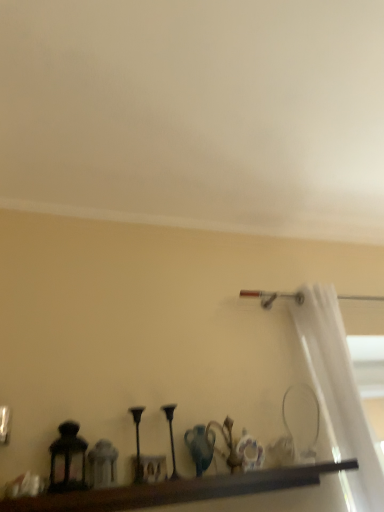
Question: Considering the relative sizes of matte black lantern at left and brown wooden shelf at lower center in the image provided, is matte black lantern at left smaller than brown wooden shelf at lower center?

Choices:
 (A) yes
 (B) no

Answer: (A)

Question: Is matte black lantern at left far away from brown wooden shelf at lower center?

Choices:
 (A) yes
 (B) no

Answer: (B)

Question: Is matte black lantern at left bigger than brown wooden shelf at lower center?

Choices:
 (A) yes
 (B) no

Answer: (B)

Question: Could you tell me if matte black lantern at left is turned towards brown wooden shelf at lower center?

Choices:
 (A) yes
 (B) no

Answer: (B)

Question: Is matte black lantern at left wider than brown wooden shelf at lower center?

Choices:
 (A) yes
 (B) no

Answer: (B)

Question: Is matte black lantern at left spatially inside brown wooden shelf at lower center, or outside of it?

Choices:
 (A) outside
 (B) inside

Answer: (A)

Question: Is matte black lantern at left taller or shorter than brown wooden shelf at lower center?

Choices:
 (A) tall
 (B) short

Answer: (A)

Question: Is matte black lantern at left wider or thinner than brown wooden shelf at lower center?

Choices:
 (A) thin
 (B) wide

Answer: (A)

Question: Considering the positions of point (74, 460) and point (251, 484), is point (74, 460) closer or farther from the camera than point (251, 484)?

Choices:
 (A) farther
 (B) closer

Answer: (B)

Question: Considering their positions, is white sheer curtain at right located in front of or behind brown wooden shelf at lower center?

Choices:
 (A) behind
 (B) front

Answer: (A)

Question: Would you say white sheer curtain at right is to the left or to the right of brown wooden shelf at lower center in the picture?

Choices:
 (A) left
 (B) right

Answer: (B)

Question: Is point (329, 310) positioned closer to the camera than point (220, 480)?

Choices:
 (A) closer
 (B) farther

Answer: (B)

Question: From a real-world perspective, is white sheer curtain at right above or below brown wooden shelf at lower center?

Choices:
 (A) above
 (B) below

Answer: (A)

Question: In terms of height, does brown wooden shelf at lower center look taller or shorter compared to matte black lantern at left?

Choices:
 (A) tall
 (B) short

Answer: (B)

Question: Considering the positions of point (269, 478) and point (54, 479), is point (269, 478) closer or farther from the camera than point (54, 479)?

Choices:
 (A) farther
 (B) closer

Answer: (A)